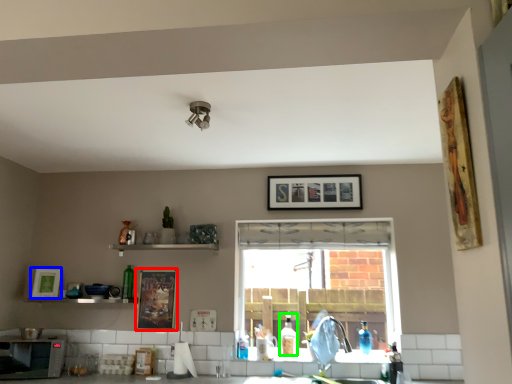
Question: Which is nearer to the picture frame (highlighted by a red box)? picture frame (highlighted by a blue box) or bottle (highlighted by a green box).

Choices:
 (A) picture frame
 (B) bottle

Answer: (A)